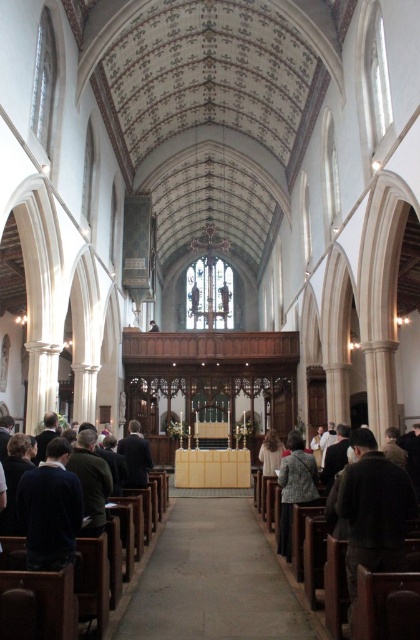
Is dark brown leather jacket at lower right further to camera compared to patterned fabric coat at lower center?

No.

Between dark brown leather jacket at lower right and patterned fabric coat at lower center, which one has less height?

patterned fabric coat at lower center

Is point (390, 470) in front of point (304, 477)?

Yes, it is in front of point (304, 477).

Identify the location of dark brown leather jacket at lower right. The height and width of the screenshot is (640, 420). (372, 509).